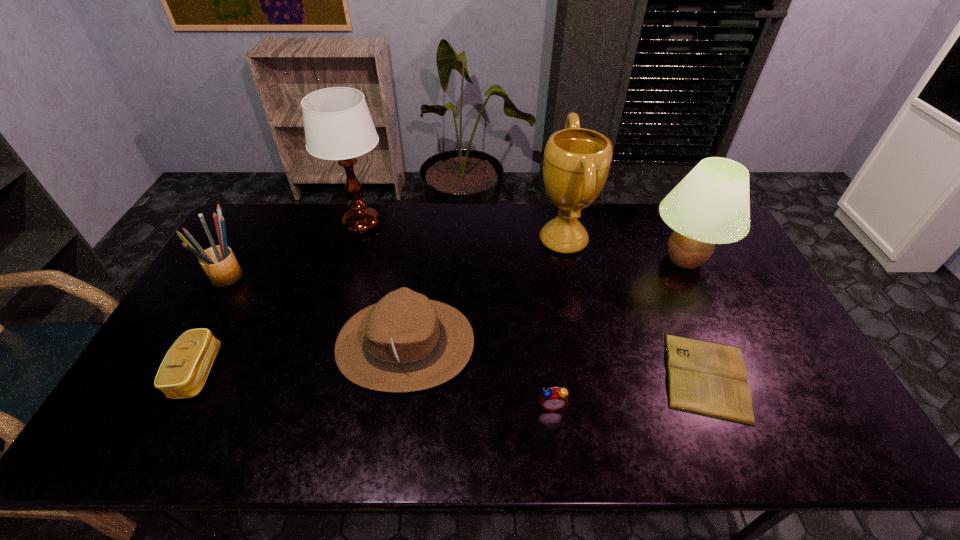
Identify the location of object at the near edge. This screenshot has height=540, width=960. (705, 378).

Locate an element on the screen. The image size is (960, 540). pencil box located at the left edge is located at coordinates (219, 263).

Image resolution: width=960 pixels, height=540 pixels. Find the location of `clutch bag at the left edge`. clutch bag at the left edge is located at coordinates (182, 374).

Identify the location of lampshade positioned at the right edge. (711, 205).

I want to click on book that is positioned at the right edge, so 705,378.

Identify the location of object located in the far right corner section of the desktop. This screenshot has height=540, width=960. (711, 205).

I want to click on object that is at the near right corner, so click(x=705, y=378).

This screenshot has width=960, height=540. In the image, there is a desktop. What are the coordinates of `free region at the far edge` in the screenshot? It's located at (476, 240).

What are the coordinates of `vacant space at the near edge` in the screenshot? It's located at (236, 446).

In the image, there is a desktop. Where is `vacant area at the left edge`? vacant area at the left edge is located at coordinates (185, 416).